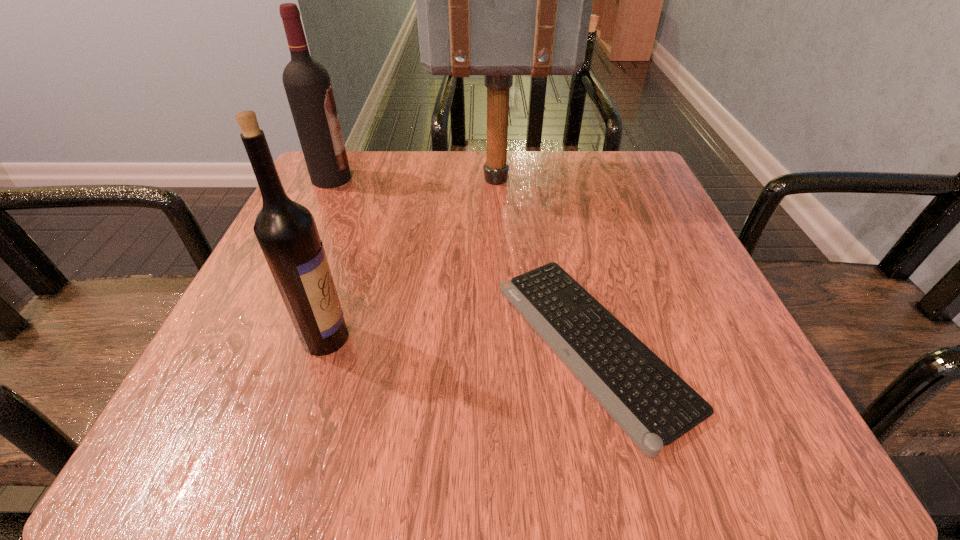
Where is `free spot between the nearer wine bottle and the shortest object`? The height and width of the screenshot is (540, 960). free spot between the nearer wine bottle and the shortest object is located at coordinates (459, 341).

Where is `empty space between the mallet and the leftmost object`? empty space between the mallet and the leftmost object is located at coordinates (415, 179).

Locate an element on the screen. This screenshot has height=540, width=960. vacant area between the tallest object and the right wine bottle is located at coordinates (412, 259).

Find the location of a particular element. vacant area that lies between the nearer wine bottle and the computer keyboard is located at coordinates (459, 341).

In order to click on object that is the closest to the second object from left to right in this screenshot , I will do `click(654, 406)`.

Locate an element on the screen. object that stands as the closest to the computer keyboard is located at coordinates (498, 0).

The image size is (960, 540). Identify the location of blank space that satisfies the following two spatial constraints: 1. on the label of the left wine bottle; 2. on the right side of the shortest object. (252, 345).

Locate an element on the screen. This screenshot has height=540, width=960. free location that satisfies the following two spatial constraints: 1. on the label of the computer keyboard; 2. on the left side of the nearer wine bottle is located at coordinates (324, 345).

In order to click on vacant space that satisfies the following two spatial constraints: 1. on the back side of the shortest object; 2. on the label of the right wine bottle in this screenshot , I will do `click(590, 338)`.

Locate an element on the screen. The width and height of the screenshot is (960, 540). vacant space that satisfies the following two spatial constraints: 1. on the label of the computer keyboard; 2. on the right side of the farther wine bottle is located at coordinates (252, 345).